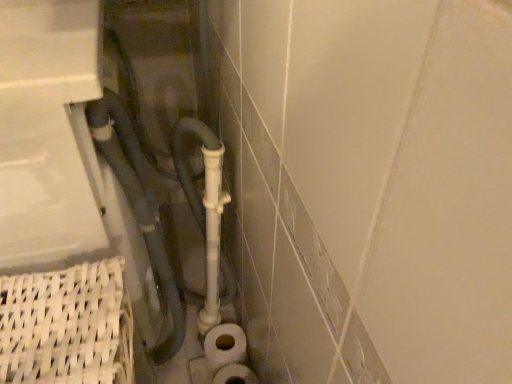
Identify the location of white matte toilet paper at lower center. The height and width of the screenshot is (384, 512). (234, 375).

The width and height of the screenshot is (512, 384). What do you see at coordinates (234, 375) in the screenshot? I see `white matte toilet paper at lower center` at bounding box center [234, 375].

Locate an element on the screen. matte gray pipe at center is located at coordinates (137, 203).

Image resolution: width=512 pixels, height=384 pixels. What do you see at coordinates (137, 203) in the screenshot?
I see `matte gray pipe at center` at bounding box center [137, 203].

What are the coordinates of `white matte toilet paper at lower center` in the screenshot? It's located at (234, 375).

Which is more to the right, matte gray pipe at center or white matte toilet paper at lower center?

From the viewer's perspective, white matte toilet paper at lower center appears more on the right side.

Between matte gray pipe at center and white matte toilet paper at lower center, which one is positioned behind?

white matte toilet paper at lower center is behind.

Is point (182, 338) closer to camera compared to point (219, 376)?

No.

From the image's perspective, which object appears higher, matte gray pipe at center or white matte toilet paper at lower center?

matte gray pipe at center is shown above in the image.

From a real-world perspective, who is located lower, matte gray pipe at center or white matte toilet paper at lower center?

white matte toilet paper at lower center is physically lower.

Is matte gray pipe at center wider than white matte toilet paper at lower center?

Correct, the width of matte gray pipe at center exceeds that of white matte toilet paper at lower center.

Considering the sizes of objects matte gray pipe at center and white matte toilet paper at lower center in the image provided, who is taller, matte gray pipe at center or white matte toilet paper at lower center?

Standing taller between the two is matte gray pipe at center.

Between matte gray pipe at center and white matte toilet paper at lower center, which one has larger size?

matte gray pipe at center is bigger.

Can we say matte gray pipe at center lies outside white matte toilet paper at lower center?

Yes, matte gray pipe at center is located beyond the bounds of white matte toilet paper at lower center.

In the scene shown: Is matte gray pipe at center placed right next to white matte toilet paper at lower center?

No.

Is matte gray pipe at center looking in the opposite direction of white matte toilet paper at lower center?

No, white matte toilet paper at lower center is not at the back of matte gray pipe at center.

How distant is matte gray pipe at center from white matte toilet paper at lower center?

matte gray pipe at center and white matte toilet paper at lower center are 35.98 centimeters apart from each other.

Locate an element on the screen. water pipe above the white matte toilet paper at lower center (from a real-world perspective) is located at coordinates (137, 203).

Considering the positions of objects white matte toilet paper at lower center and matte gray pipe at center in the image provided, who is more to the right, white matte toilet paper at lower center or matte gray pipe at center?

Positioned to the right is white matte toilet paper at lower center.

Which object is further away from the camera taking this photo, white matte toilet paper at lower center or matte gray pipe at center?

white matte toilet paper at lower center is more distant.

Between point (233, 371) and point (147, 239), which one is positioned in front?

Positioned in front is point (147, 239).

From the image's perspective, between white matte toilet paper at lower center and matte gray pipe at center, which one is located above?

matte gray pipe at center appears higher in the image.

From a real-world perspective, is white matte toilet paper at lower center physically located above or below matte gray pipe at center?

white matte toilet paper at lower center is below matte gray pipe at center.

Can you confirm if white matte toilet paper at lower center is thinner than matte gray pipe at center?

Indeed, white matte toilet paper at lower center has a lesser width compared to matte gray pipe at center.

Does white matte toilet paper at lower center have a greater height compared to matte gray pipe at center?

In fact, white matte toilet paper at lower center may be shorter than matte gray pipe at center.

Considering the sizes of objects white matte toilet paper at lower center and matte gray pipe at center in the image provided, who is smaller, white matte toilet paper at lower center or matte gray pipe at center?

Smaller between the two is white matte toilet paper at lower center.

Is white matte toilet paper at lower center located outside matte gray pipe at center?

Yes, white matte toilet paper at lower center is outside of matte gray pipe at center.

Is white matte toilet paper at lower center with matte gray pipe at center?

white matte toilet paper at lower center is not next to matte gray pipe at center, and they're not touching.

Is white matte toilet paper at lower center oriented away from matte gray pipe at center?

No, white matte toilet paper at lower center is not facing away from matte gray pipe at center.

You are a GUI agent. You are given a task and a screenshot of the screen. Output one action in this format:
    pyautogui.click(x=<x>, y=<y>)
    Task: Click on the toilet paper below the matte gray pipe at center (from the image's perspective)
    
    Given the screenshot: What is the action you would take?
    pyautogui.click(x=234, y=375)

At what (x,y) coordinates should I click in order to perform the action: click on toilet paper below the matte gray pipe at center (from a real-world perspective). Please return your answer as a coordinate pair (x, y). The width and height of the screenshot is (512, 384). Looking at the image, I should click on (234, 375).

You are a GUI agent. You are given a task and a screenshot of the screen. Output one action in this format:
    pyautogui.click(x=<x>, y=<y>)
    Task: Click on the toilet paper lying behind the matte gray pipe at center
    
    Given the screenshot: What is the action you would take?
    pyautogui.click(x=234, y=375)